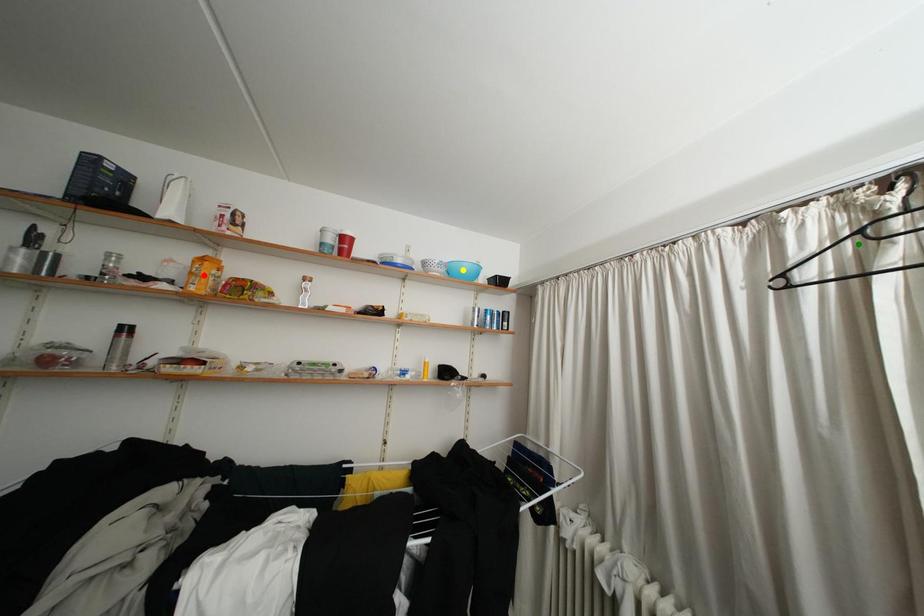
Order these from nearest to farthest:
green point, red point, yellow point

1. green point
2. red point
3. yellow point